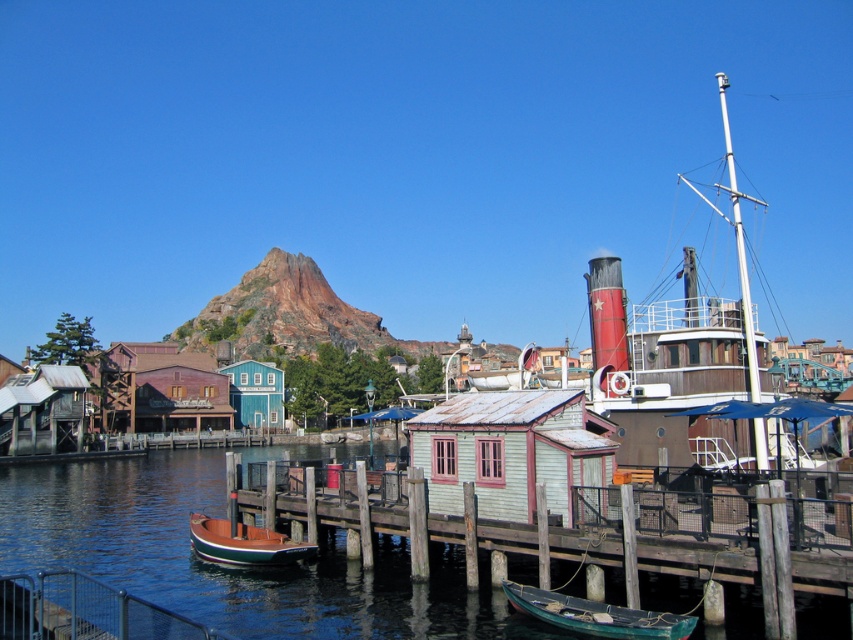
Between point (189, 387) and point (283, 540), which one is positioned behind?

The point (189, 387) is behind.

Can you confirm if wooden hut at center is wider than green polished wood boat at lower left?

Indeed, wooden hut at center has a greater width compared to green polished wood boat at lower left.

Between point (219, 376) and point (259, 548), which one is positioned in front?

Point (259, 548) is in front.

Where is `wooden hut at center`? This screenshot has width=853, height=640. wooden hut at center is located at coordinates (160, 388).

This screenshot has width=853, height=640. I want to click on wooden hut at center, so click(x=160, y=388).

Identify the location of wooden hut at center. The image size is (853, 640). (160, 388).

Where is `wooden hut at center`? wooden hut at center is located at coordinates (160, 388).

Where is `green painted wood boat at lower center`? This screenshot has height=640, width=853. green painted wood boat at lower center is located at coordinates (596, 614).

Does green painted wood boat at lower center appear on the right side of green polished wood boat at lower left?

Indeed, green painted wood boat at lower center is positioned on the right side of green polished wood boat at lower left.

Who is more distant from viewer, [572,628] or [210,545]?

Point [210,545]

The width and height of the screenshot is (853, 640). I want to click on green painted wood boat at lower center, so click(596, 614).